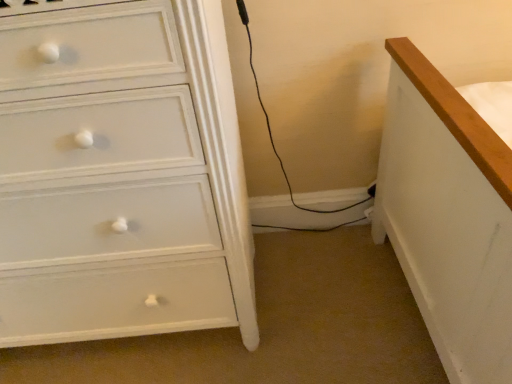
Describe the element at coordinates (121, 175) in the screenshot. I see `white painted wood chest of drawers at left` at that location.

You are a GUI agent. You are given a task and a screenshot of the screen. Output one action in this format:
    pyautogui.click(x=<x>, y=<y>)
    Task: Click on the white painted wood chest of drawers at left
    The height and width of the screenshot is (384, 512).
    Given the screenshot: What is the action you would take?
    pyautogui.click(x=121, y=175)

Find the location of a particular element. The image size is (512, 384). white painted wood chest of drawers at left is located at coordinates (121, 175).